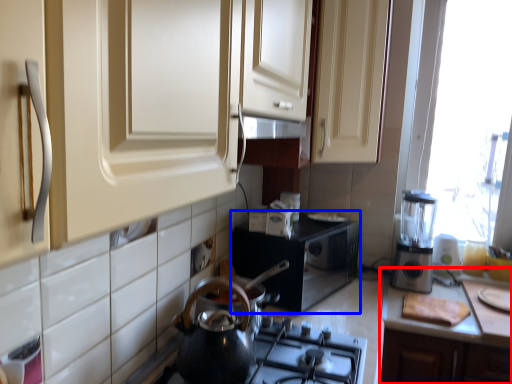
Question: Which object appears closest to the camera in this image, countertop (highlighted by a red box) or appliance (highlighted by a blue box)?

Choices:
 (A) countertop
 (B) appliance

Answer: (A)